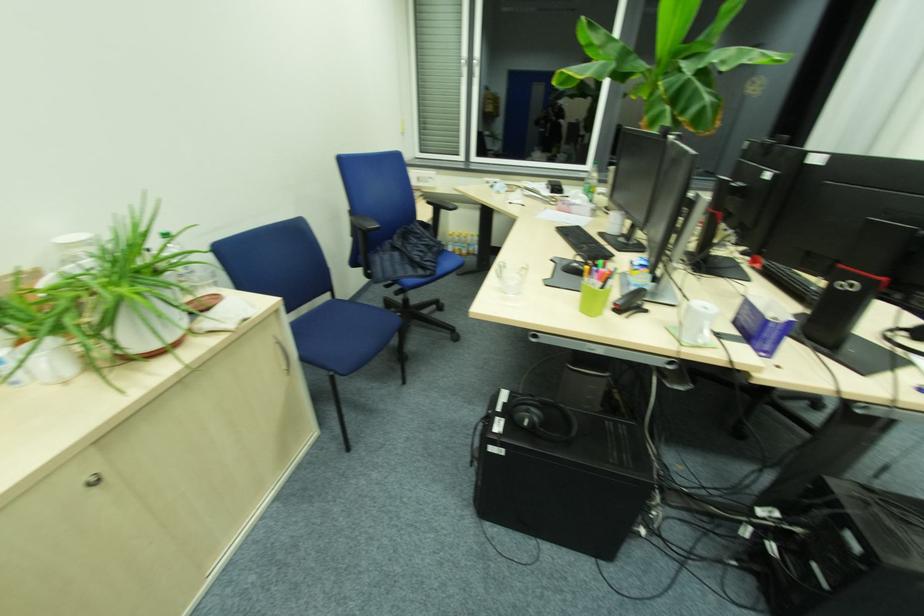
Which object does [541,418] point to?

It refers to a black headphones.